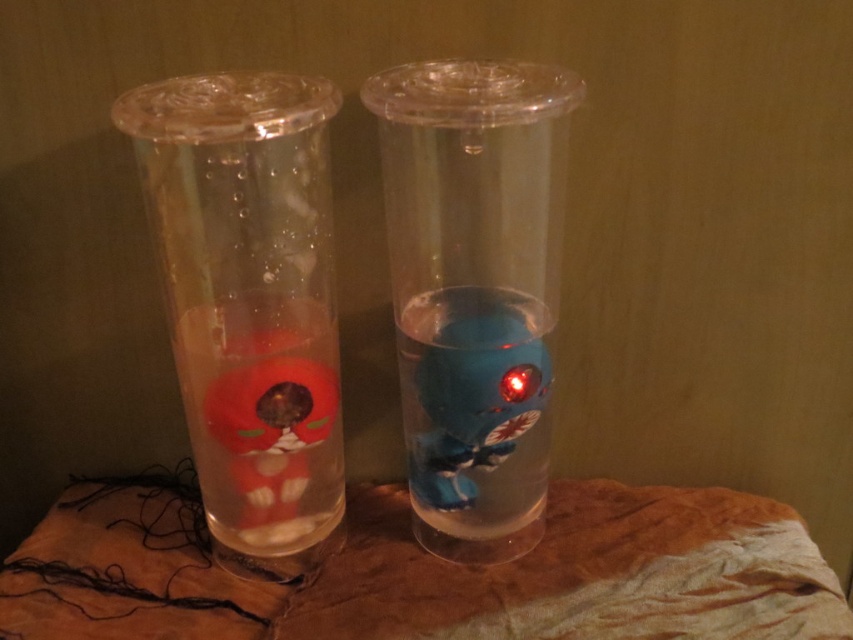
Question: Is brown fabric at center wider than matte plastic cup at left?

Choices:
 (A) yes
 (B) no

Answer: (A)

Question: In this image, where is matte plastic cup at left located relative to transparent plastic vase at center?

Choices:
 (A) right
 (B) left

Answer: (B)

Question: Among these points, which one is farthest from the camera?

Choices:
 (A) (462, 268)
 (B) (494, 593)

Answer: (B)

Question: Is matte plastic cup at left closer to the viewer compared to transparent plastic vase at center?

Choices:
 (A) no
 (B) yes

Answer: (B)

Question: Which point is closer to the camera taking this photo?

Choices:
 (A) (408, 458)
 (B) (334, 531)

Answer: (B)

Question: Which point appears closest to the camera in this image?

Choices:
 (A) (457, 260)
 (B) (282, 522)
 (C) (165, 596)

Answer: (A)